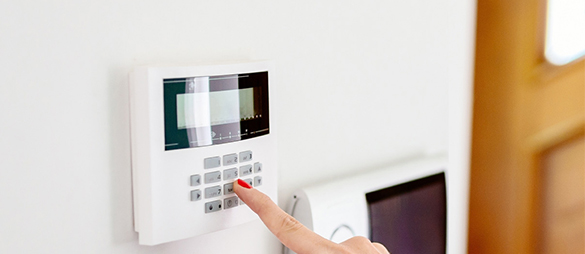
Identify the location of wall. Image resolution: width=585 pixels, height=254 pixels. (392, 86).